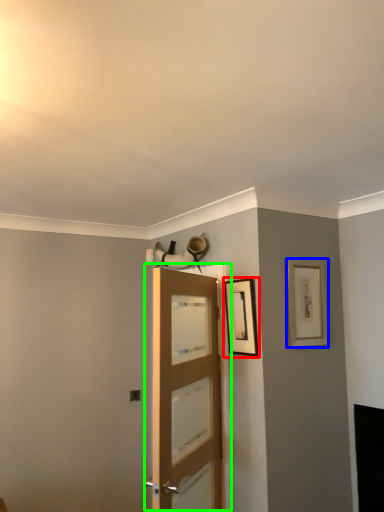
Question: Which object is positioned farthest from picture frame (highlighted by a red box)? Select from picture frame (highlighted by a blue box) and door (highlighted by a green box).

Choices:
 (A) picture frame
 (B) door

Answer: (B)